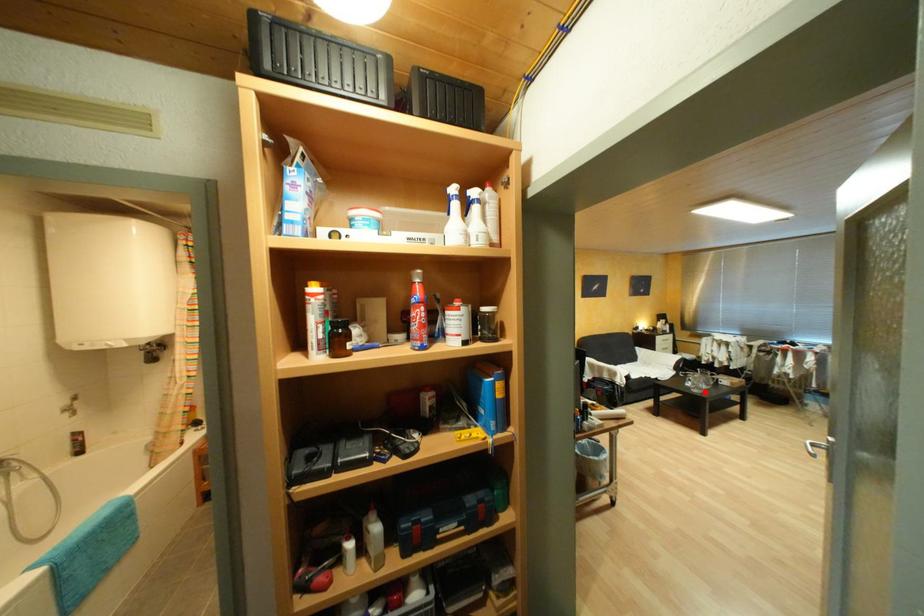
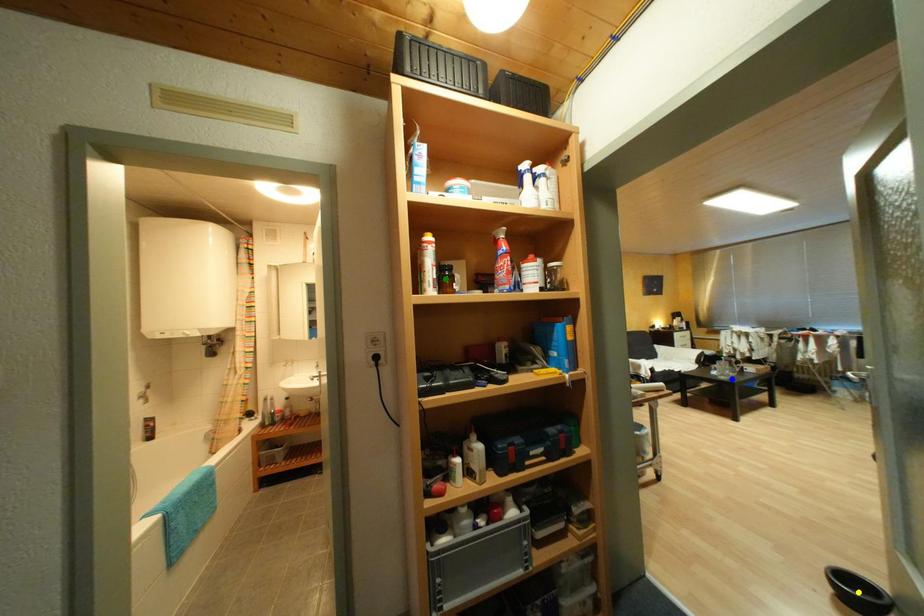
Question: I am providing you with two images of the same scene from different viewpoints. A red point is marked on the first image. You are given multiple points on the second image. Which spot in image 2 lines up with the point in image 1?

Choices:
 (A) green point
 (B) yellow point
 (C) blue point

Answer: (C)